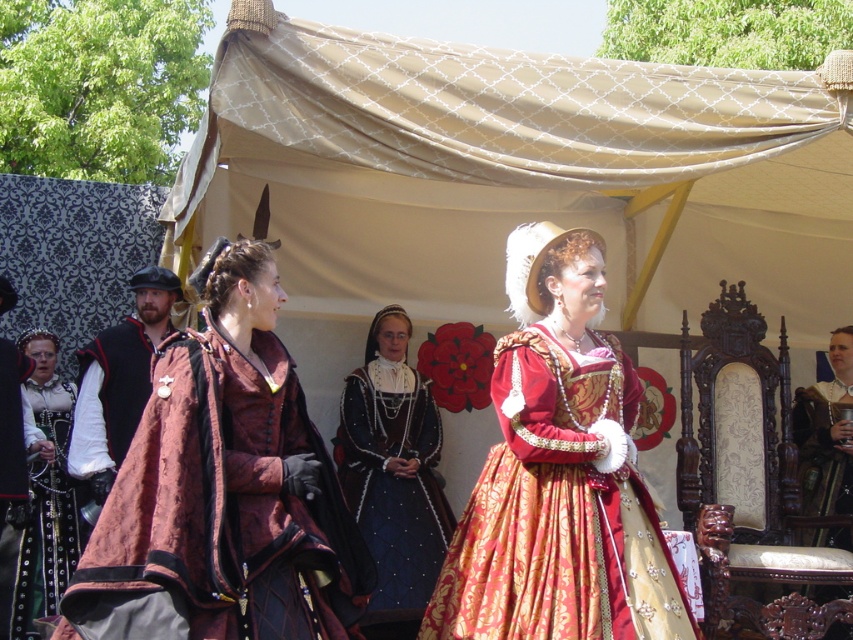
You are a photographer at the Renaissance fair and want to focus on the two points marked in the image. Which point, point [28,630] or point [12,536], is closer to your camera lens?

Point [28,630] is closer to the camera lens than point [12,536].

You are a photographer standing at the event. You want to take a closeup photo of the dark blue satin gown at center. Considering the distance, is it possible to capture a clear closeup without moving closer?

The dark blue satin gown at center is 26.57 meters away from the viewer. At this distance, capturing a clear closeup without moving closer would be challenging as standard camera lenses typically struggle to focus and maintain clarity at such a range. A telephoto lens might help, but clarity cannot be guaranteed without adjusting the distance.